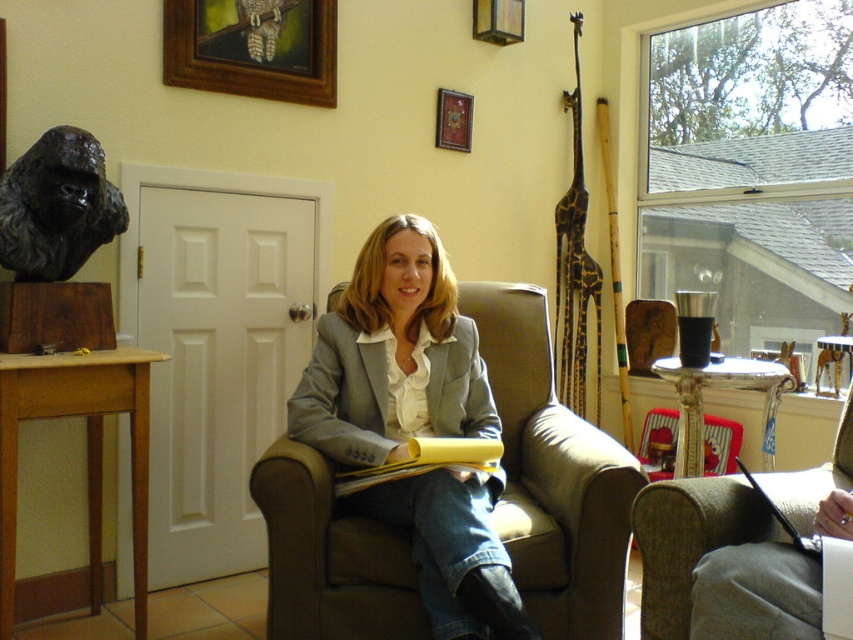
What do you see at coordinates (57, 205) in the screenshot? The width and height of the screenshot is (853, 640). I see `black bronze gorilla head at left` at bounding box center [57, 205].

Between black bronze gorilla head at left and wooden picture frame at upper center, which one has more height?

With more height is black bronze gorilla head at left.

Does point (10, 182) lie in front of point (450, 106)?

Yes, it is in front of point (450, 106).

You are a GUI agent. You are given a task and a screenshot of the screen. Output one action in this format:
    pyautogui.click(x=<x>, y=<y>)
    Task: Click on the black bronze gorilla head at left
    The image size is (853, 640).
    Given the screenshot: What is the action you would take?
    pos(57,205)

Is wooden picture frame at upper left to the left of wooden picture frame at upper center from the viewer's perspective?

Correct, you'll find wooden picture frame at upper left to the left of wooden picture frame at upper center.

Which is more to the right, wooden picture frame at upper left or wooden picture frame at upper center?

From the viewer's perspective, wooden picture frame at upper center appears more on the right side.

Image resolution: width=853 pixels, height=640 pixels. Describe the element at coordinates (252, 48) in the screenshot. I see `wooden picture frame at upper left` at that location.

You are a GUI agent. You are given a task and a screenshot of the screen. Output one action in this format:
    pyautogui.click(x=<x>, y=<y>)
    Task: Click on the wooden picture frame at upper left
    The width and height of the screenshot is (853, 640).
    Given the screenshot: What is the action you would take?
    pyautogui.click(x=252, y=48)

Can you confirm if wooden picture frame at upper left is positioned to the right of black bronze gorilla head at left?

Correct, you'll find wooden picture frame at upper left to the right of black bronze gorilla head at left.

Between wooden picture frame at upper left and black bronze gorilla head at left, which one appears on the left side from the viewer's perspective?

black bronze gorilla head at left is more to the left.

Does point (163, 12) come farther from viewer compared to point (57, 138)?

That is True.

What are the coordinates of `wooden picture frame at upper left` in the screenshot? It's located at click(x=252, y=48).